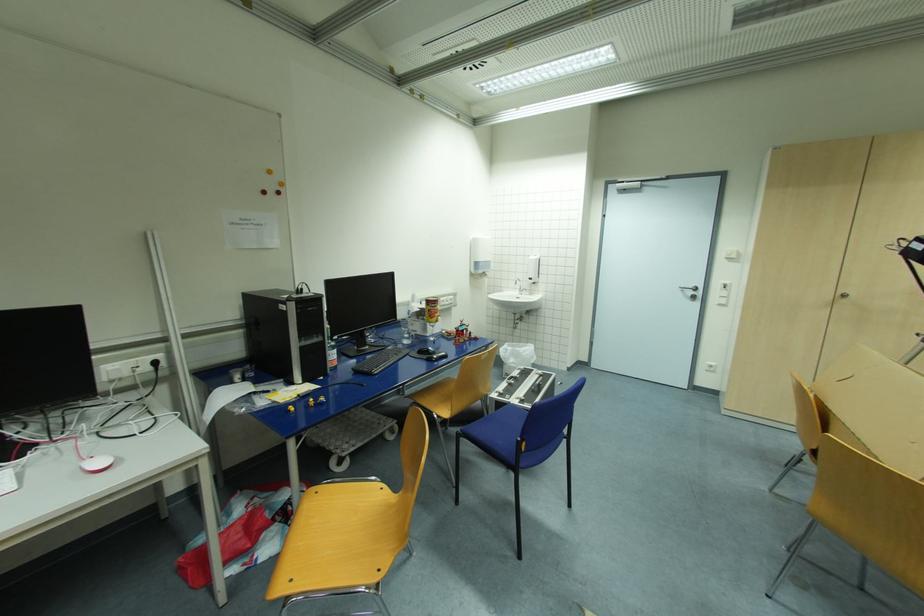
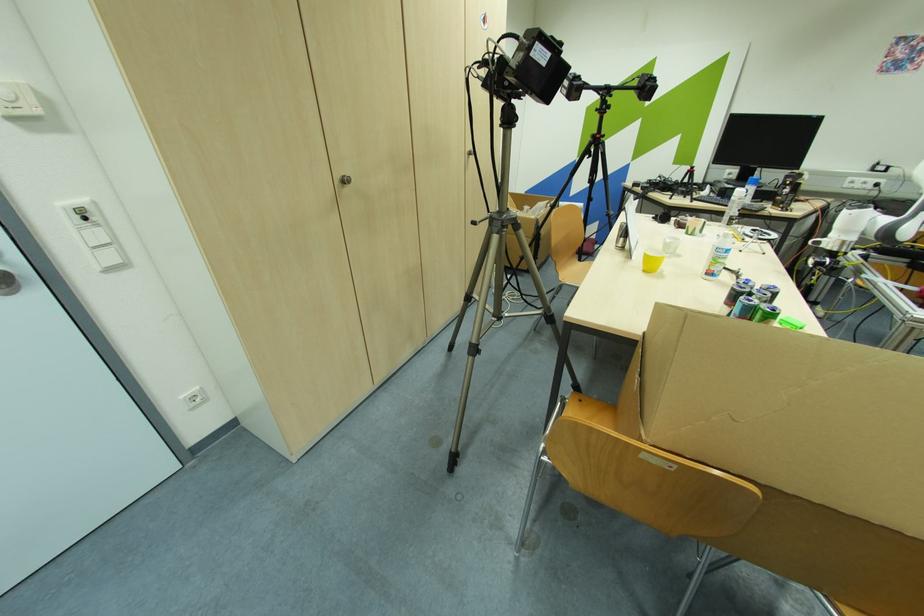
The point at [847,296] is marked in the first image. Where is the corresponding point in the second image?

(348, 182)